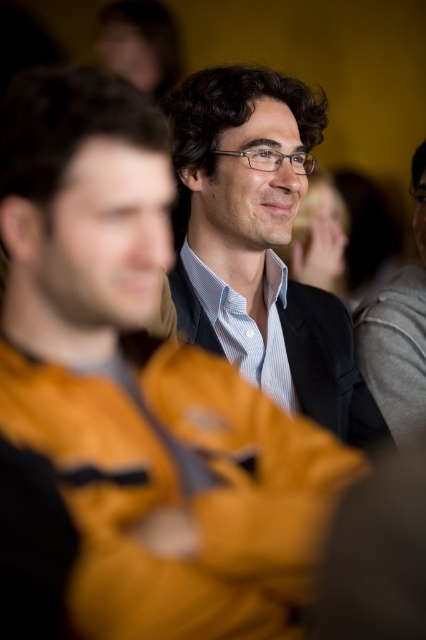
You are at a social gathering and notice a man in a light blue shirt and dark blazer at the center. There is also a point marked at coordinates (259, 244). What object is located at that point?

The point at coordinates (259, 244) is occupied by a matte black suit at center.

You are a photographer at the event and want to take a photo of the matte black suit at center without the gray wool sweater at right appearing in the background. Is the current camera setup with a shallow depth of field suitable for this?

The matte black suit at center is in front of the gray wool sweater at right, so the shallow depth of field will blur the background, making the gray wool sweater at right less visible. This setup is suitable for isolating the matte black suit at center.